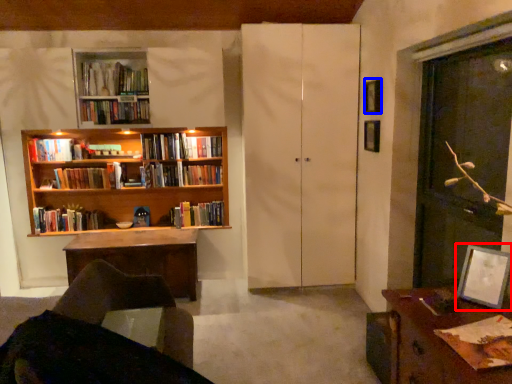
Question: Among these objects, which one is nearest to the camera, picture frame (highlighted by a red box) or picture frame (highlighted by a blue box)?

Choices:
 (A) picture frame
 (B) picture frame

Answer: (A)